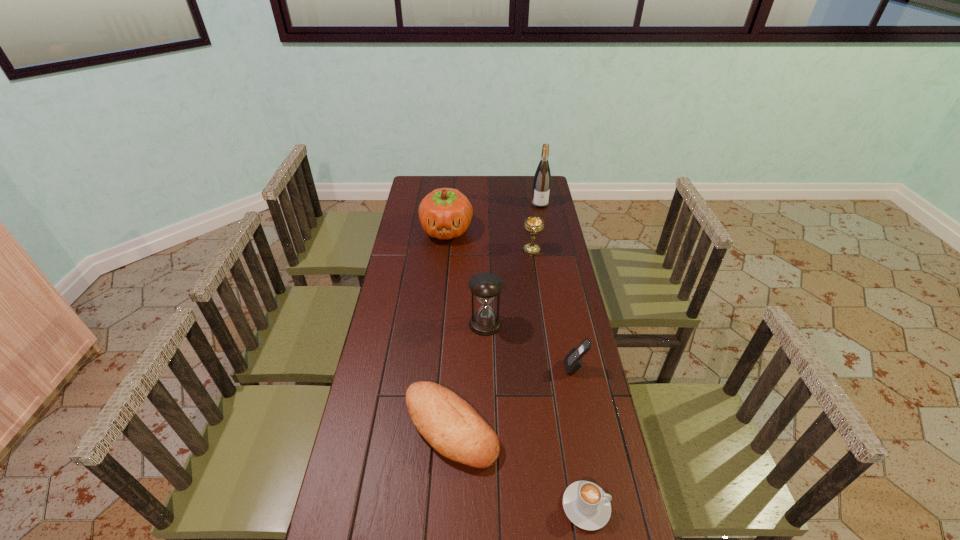
Image resolution: width=960 pixels, height=540 pixels. What are the coordinates of `the nearest object` in the screenshot? It's located at (587, 506).

At what (x,y) coordinates should I click in order to perform the action: click on blank space located on the back of the tallest object. Please return your answer as a coordinate pair (x, y). Looking at the image, I should click on (535, 178).

Identify the location of vacant space located 0.350m on the side of the pumpkin with the cute face. (440, 302).

Identify the location of vacant point located on the front of the hourglass. Image resolution: width=960 pixels, height=540 pixels. (486, 381).

Where is `vacant region located 0.050m on the left of the chalice`? Image resolution: width=960 pixels, height=540 pixels. vacant region located 0.050m on the left of the chalice is located at coordinates coord(511,250).

Where is `vacant space located 0.180m on the front-facing side of the fifth farthest object`? The height and width of the screenshot is (540, 960). vacant space located 0.180m on the front-facing side of the fifth farthest object is located at coordinates click(510, 367).

Where is `vacant space located on the front-facing side of the fifth farthest object`? The height and width of the screenshot is (540, 960). vacant space located on the front-facing side of the fifth farthest object is located at coordinates (546, 367).

At what (x,y) coordinates should I click in order to perform the action: click on vacant space situated 0.170m on the front-facing side of the fifth farthest object. Please return your answer as a coordinate pair (x, y). Looking at the image, I should click on (513, 367).

At what (x,y) coordinates should I click in order to perform the action: click on vacant space located 0.260m on the right of the second shortest object. Please return your answer as a coordinate pair (x, y). This screenshot has height=540, width=960. Looking at the image, I should click on (588, 428).

The height and width of the screenshot is (540, 960). I want to click on pumpkin present at the left edge, so click(x=445, y=213).